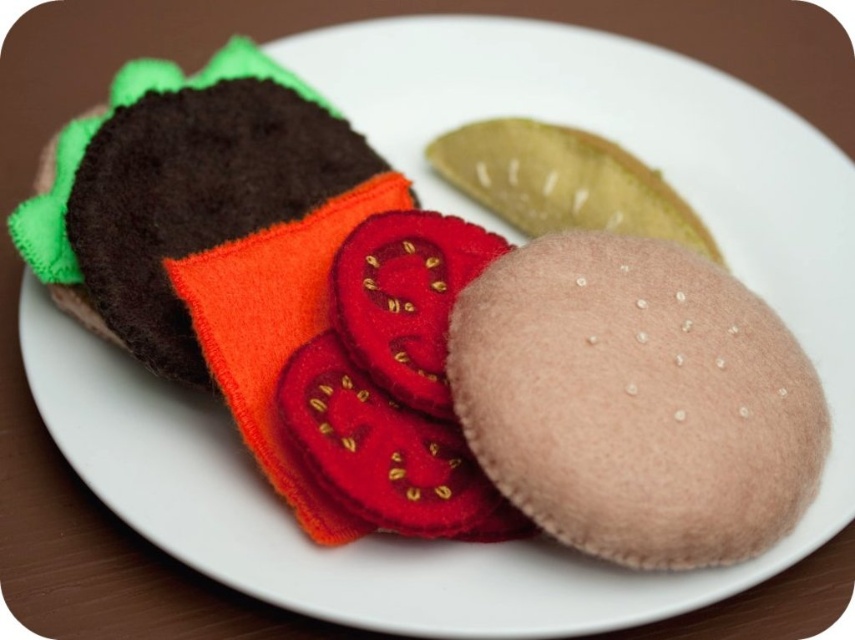
Does beige felt biscuit at center have a larger size compared to smooth brown kiwi at center?

Yes.

Is point (690, 305) closer to camera compared to point (453, 177)?

Yes, point (690, 305) is closer to viewer.

This screenshot has height=640, width=855. I want to click on beige felt biscuit at center, so click(x=635, y=401).